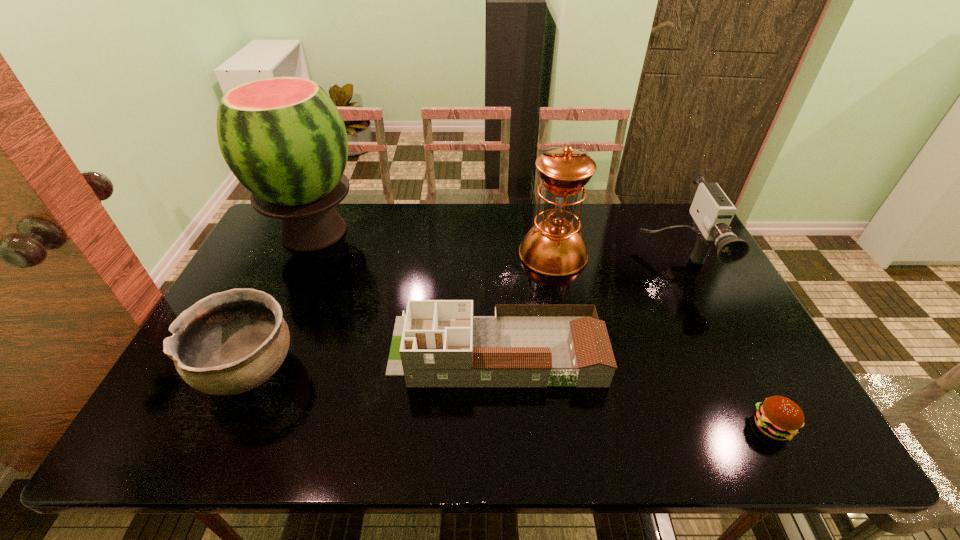
The image size is (960, 540). Identify the location of vacant area at the far right corner of the desktop. (669, 210).

This screenshot has width=960, height=540. What are the coordinates of `vacant point located between the tallest object and the pottery` in the screenshot? It's located at (282, 301).

Find the location of a particular element. The image size is (960, 540). empty location between the dollhouse and the fifth shortest object is located at coordinates (524, 302).

Locate an element on the screen. free space between the camcorder and the tallest object is located at coordinates (494, 246).

What are the coordinates of `empty space that is in between the dollhouse and the hamburger` in the screenshot? It's located at click(x=634, y=388).

Identify the location of vacant space in between the oil lamp and the watermelon. Image resolution: width=960 pixels, height=540 pixels. (434, 243).

Find the location of a particular element. Image resolution: width=960 pixels, height=540 pixels. empty location between the hamburger and the camcorder is located at coordinates (724, 343).

Identify the location of free space between the pottery and the shortest object. The width and height of the screenshot is (960, 540). (511, 397).

I want to click on vacant space in between the tallest object and the dollhouse, so click(x=405, y=291).

This screenshot has height=540, width=960. In order to click on unoccupied position between the hamburger and the fourth shortest object in this screenshot , I will do `click(724, 343)`.